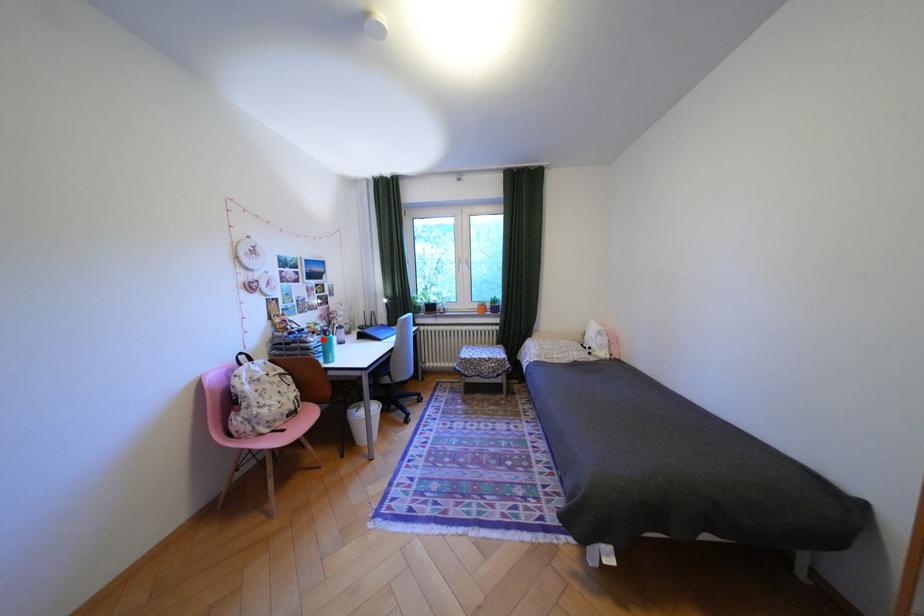
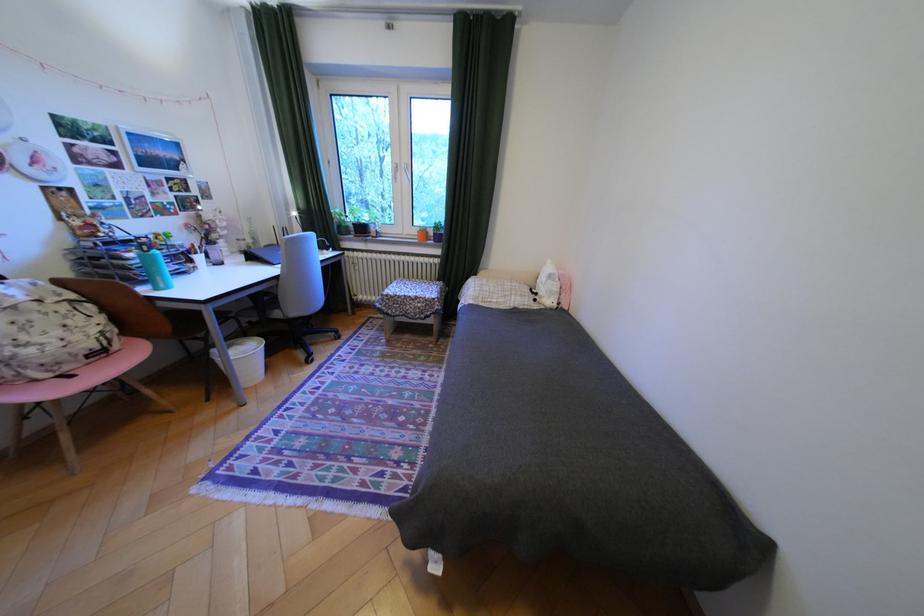
Find the pixel in the second image that matches the highlighted location in the first image.

(140, 254)